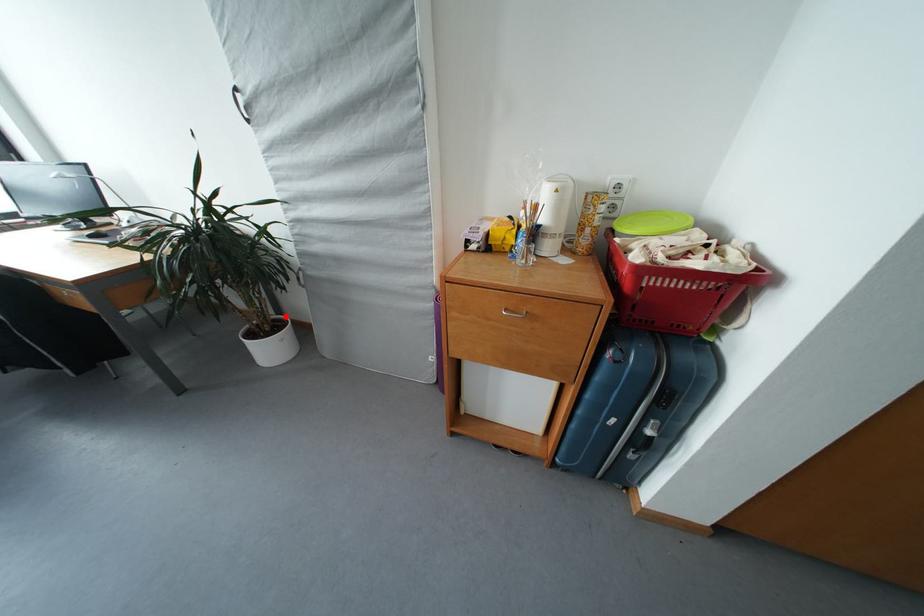
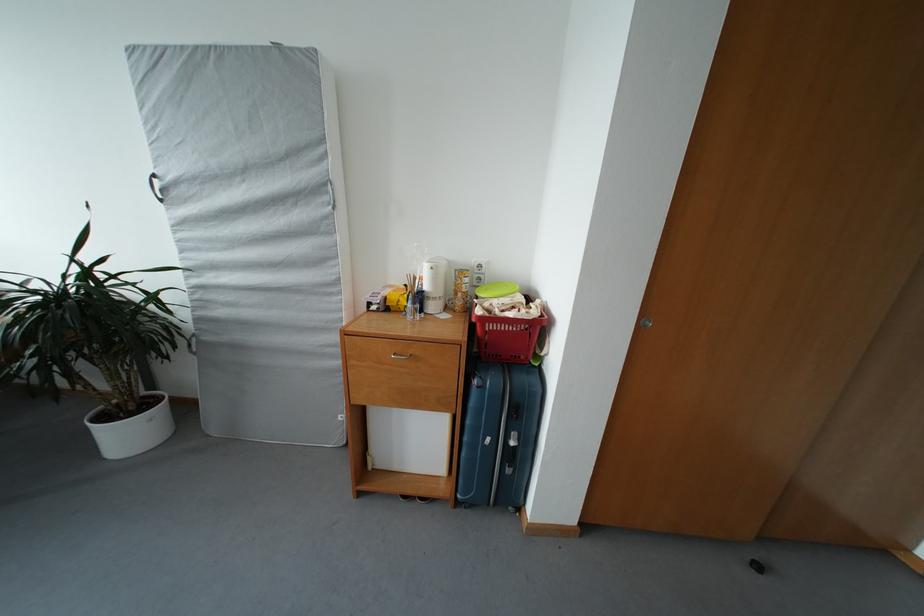
In the second image, find the point that corresponds to the highlighted location in the first image.

(159, 391)